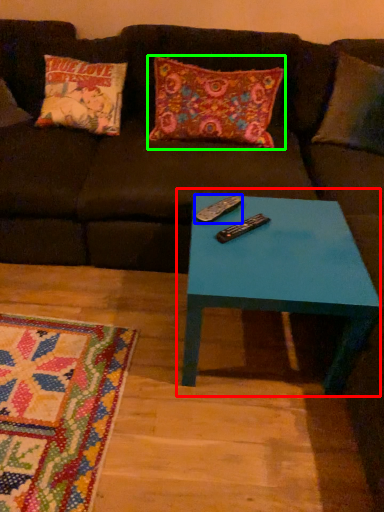
Question: Which object is positioned closest to coffee table (highlighted by a red box)? Select from remote (highlighted by a blue box) and pillow (highlighted by a green box).

Choices:
 (A) remote
 (B) pillow

Answer: (A)